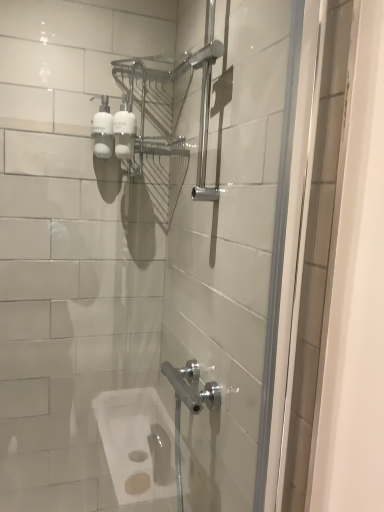
What do you see at coordinates (103, 130) in the screenshot?
I see `white glossy pump bottles at upper left, the 1th toiletry from the left` at bounding box center [103, 130].

Where is `white glossy pump bottles at upper left, the 2th toiletry viewed from the right`? This screenshot has width=384, height=512. white glossy pump bottles at upper left, the 2th toiletry viewed from the right is located at coordinates (103, 130).

What is the approximate height of white matte pump bottle at upper center, the 2th toiletry positioned from the left?

white matte pump bottle at upper center, the 2th toiletry positioned from the left, is 7.06 inches in height.

The width and height of the screenshot is (384, 512). Describe the element at coordinates (124, 130) in the screenshot. I see `white matte pump bottle at upper center, the 1th toiletry from the right` at that location.

Locate an element on the screen. white matte pump bottle at upper center, the 1th toiletry from the right is located at coordinates (124, 130).

Locate an element on the screen. The image size is (384, 512). white glossy pump bottles at upper left, the 2th toiletry viewed from the right is located at coordinates (103, 130).

Is white matte pump bottle at upper center, the 2th toiletry positioned from the left, to the left of white glossy pump bottles at upper left, the 1th toiletry from the left, from the viewer's perspective?

No, white matte pump bottle at upper center, the 2th toiletry positioned from the left, is not to the left of white glossy pump bottles at upper left, the 1th toiletry from the left.

Considering their positions, is white matte pump bottle at upper center, the 2th toiletry positioned from the left, located in front of or behind white glossy pump bottles at upper left, the 1th toiletry from the left?

Clearly, white matte pump bottle at upper center, the 2th toiletry positioned from the left, is in front of white glossy pump bottles at upper left, the 1th toiletry from the left.

Is point (132, 125) positioned after point (105, 109)?

No.

From the image's perspective, is white matte pump bottle at upper center, the 1th toiletry from the right, under white glossy pump bottles at upper left, the 1th toiletry from the left?

Correct, white matte pump bottle at upper center, the 1th toiletry from the right, appears lower than white glossy pump bottles at upper left, the 1th toiletry from the left, in the image.

From a real-world perspective, does white matte pump bottle at upper center, the 2th toiletry positioned from the left, stand above white glossy pump bottles at upper left, the 1th toiletry from the left?

Incorrect, from a real-world perspective, white matte pump bottle at upper center, the 2th toiletry positioned from the left, is lower than white glossy pump bottles at upper left, the 1th toiletry from the left.

Considering the sizes of objects white matte pump bottle at upper center, the 1th toiletry from the right, and white glossy pump bottles at upper left, the 1th toiletry from the left, in the image provided, who is thinner, white matte pump bottle at upper center, the 1th toiletry from the right, or white glossy pump bottles at upper left, the 1th toiletry from the left,?

white glossy pump bottles at upper left, the 1th toiletry from the left, is thinner.

Considering the relative sizes of white matte pump bottle at upper center, the 2th toiletry positioned from the left, and white glossy pump bottles at upper left, the 2th toiletry viewed from the right, in the image provided, is white matte pump bottle at upper center, the 2th toiletry positioned from the left, shorter than white glossy pump bottles at upper left, the 2th toiletry viewed from the right,?

Yes, white matte pump bottle at upper center, the 2th toiletry positioned from the left, is shorter than white glossy pump bottles at upper left, the 2th toiletry viewed from the right.

Between white matte pump bottle at upper center, the 1th toiletry from the right, and white glossy pump bottles at upper left, the 1th toiletry from the left, which one has smaller size?

Smaller between the two is white matte pump bottle at upper center, the 1th toiletry from the right.

Is white matte pump bottle at upper center, the 1th toiletry from the right, positioned beyond the bounds of white glossy pump bottles at upper left, the 1th toiletry from the left?

That's correct, white matte pump bottle at upper center, the 1th toiletry from the right, is outside of white glossy pump bottles at upper left, the 1th toiletry from the left.

Is the surface of white matte pump bottle at upper center, the 2th toiletry positioned from the left, in direct contact with white glossy pump bottles at upper left, the 2th toiletry viewed from the right?

Yes, white matte pump bottle at upper center, the 2th toiletry positioned from the left, is touching white glossy pump bottles at upper left, the 2th toiletry viewed from the right.

Does white matte pump bottle at upper center, the 2th toiletry positioned from the left, turn towards white glossy pump bottles at upper left, the 2th toiletry viewed from the right?

No, white matte pump bottle at upper center, the 2th toiletry positioned from the left, is not oriented towards white glossy pump bottles at upper left, the 2th toiletry viewed from the right.

Based on the photo, how much distance is there between white matte pump bottle at upper center, the 1th toiletry from the right, and white glossy pump bottles at upper left, the 2th toiletry viewed from the right?

white matte pump bottle at upper center, the 1th toiletry from the right, is 1.75 inches away from white glossy pump bottles at upper left, the 2th toiletry viewed from the right.

Where is `toiletry that appears on the left of white matte pump bottle at upper center, the 1th toiletry from the right`? The width and height of the screenshot is (384, 512). toiletry that appears on the left of white matte pump bottle at upper center, the 1th toiletry from the right is located at coordinates (103, 130).

Consider the image. Would you say white glossy pump bottles at upper left, the 1th toiletry from the left, is to the left or to the right of white matte pump bottle at upper center, the 2th toiletry positioned from the left, in the picture?

Based on their positions, white glossy pump bottles at upper left, the 1th toiletry from the left, is located to the left of white matte pump bottle at upper center, the 2th toiletry positioned from the left.

Between white glossy pump bottles at upper left, the 1th toiletry from the left, and white matte pump bottle at upper center, the 1th toiletry from the right, which one is positioned behind?

white glossy pump bottles at upper left, the 1th toiletry from the left, is behind.

Which is behind, point (100, 142) or point (128, 119)?

Positioned behind is point (100, 142).

From the image's perspective, relative to white matte pump bottle at upper center, the 2th toiletry positioned from the left, is white glossy pump bottles at upper left, the 2th toiletry viewed from the right, above or below?

Clearly, from the image's perspective, white glossy pump bottles at upper left, the 2th toiletry viewed from the right, is above white matte pump bottle at upper center, the 2th toiletry positioned from the left.

From the picture: From a real-world perspective, who is located lower, white glossy pump bottles at upper left, the 1th toiletry from the left, or white matte pump bottle at upper center, the 1th toiletry from the right?

In real-world perspective, white matte pump bottle at upper center, the 1th toiletry from the right, is lower.

Which of these two, white glossy pump bottles at upper left, the 1th toiletry from the left, or white matte pump bottle at upper center, the 2th toiletry positioned from the left, is wider?

With larger width is white matte pump bottle at upper center, the 2th toiletry positioned from the left.

Considering the relative sizes of white glossy pump bottles at upper left, the 1th toiletry from the left, and white matte pump bottle at upper center, the 1th toiletry from the right, in the image provided, is white glossy pump bottles at upper left, the 1th toiletry from the left, taller than white matte pump bottle at upper center, the 1th toiletry from the right,?

Indeed, white glossy pump bottles at upper left, the 1th toiletry from the left, has a greater height compared to white matte pump bottle at upper center, the 1th toiletry from the right.

Can you confirm if white glossy pump bottles at upper left, the 1th toiletry from the left, is bigger than white matte pump bottle at upper center, the 2th toiletry positioned from the left?

Indeed, white glossy pump bottles at upper left, the 1th toiletry from the left, has a larger size compared to white matte pump bottle at upper center, the 2th toiletry positioned from the left.

Can we say white glossy pump bottles at upper left, the 2th toiletry viewed from the right, lies outside white matte pump bottle at upper center, the 2th toiletry positioned from the left?

Indeed, white glossy pump bottles at upper left, the 2th toiletry viewed from the right, is completely outside white matte pump bottle at upper center, the 2th toiletry positioned from the left.

Is white glossy pump bottles at upper left, the 1th toiletry from the left, with white matte pump bottle at upper center, the 2th toiletry positioned from the left?

Yes, white glossy pump bottles at upper left, the 1th toiletry from the left, is with white matte pump bottle at upper center, the 2th toiletry positioned from the left.

Is white glossy pump bottles at upper left, the 1th toiletry from the left, oriented towards white matte pump bottle at upper center, the 2th toiletry positioned from the left?

No, white glossy pump bottles at upper left, the 1th toiletry from the left, is not oriented towards white matte pump bottle at upper center, the 2th toiletry positioned from the left.

How many degrees apart are the facing directions of white glossy pump bottles at upper left, the 1th toiletry from the left, and white matte pump bottle at upper center, the 2th toiletry positioned from the left?

There is a 1.45-degree angle between the facing directions of white glossy pump bottles at upper left, the 1th toiletry from the left, and white matte pump bottle at upper center, the 2th toiletry positioned from the left.

Could you measure the distance between white glossy pump bottles at upper left, the 1th toiletry from the left, and white matte pump bottle at upper center, the 2th toiletry positioned from the left?

white glossy pump bottles at upper left, the 1th toiletry from the left, and white matte pump bottle at upper center, the 2th toiletry positioned from the left, are 1.75 inches apart from each other.

Identify the location of toiletry that is under the white glossy pump bottles at upper left, the 1th toiletry from the left (from a real-world perspective). (124, 130).

This screenshot has height=512, width=384. What are the coordinates of `toiletry that is above the white matte pump bottle at upper center, the 1th toiletry from the right (from the image's perspective)` in the screenshot? It's located at coord(103,130).

Locate an element on the screen. Image resolution: width=384 pixels, height=512 pixels. toiletry on the left of white matte pump bottle at upper center, the 1th toiletry from the right is located at coordinates (103, 130).